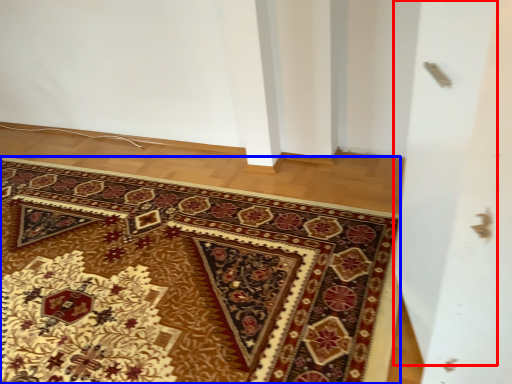
Question: Which object is closer to the camera taking this photo, screen door (highlighted by a red box) or mat (highlighted by a blue box)?

Choices:
 (A) screen door
 (B) mat

Answer: (A)